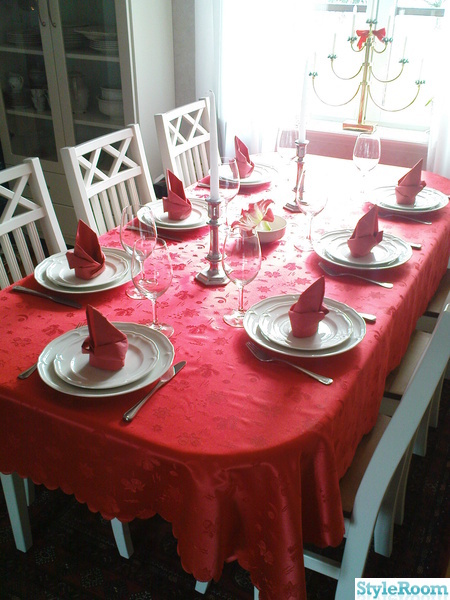
This screenshot has width=450, height=600. Identify the location of 6 chairs. click(x=20, y=219), click(x=100, y=182), click(x=198, y=143), click(x=415, y=398), click(x=408, y=353), click(x=440, y=301).